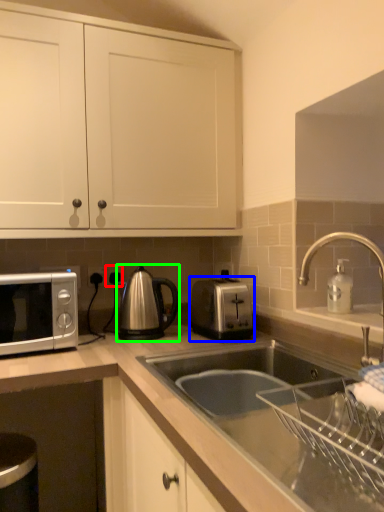
Question: Considering the real-world distances, which object is closest to electric outlet (highlighted by a red box)? toaster (highlighted by a blue box) or tea pot (highlighted by a green box).

Choices:
 (A) toaster
 (B) tea pot

Answer: (B)